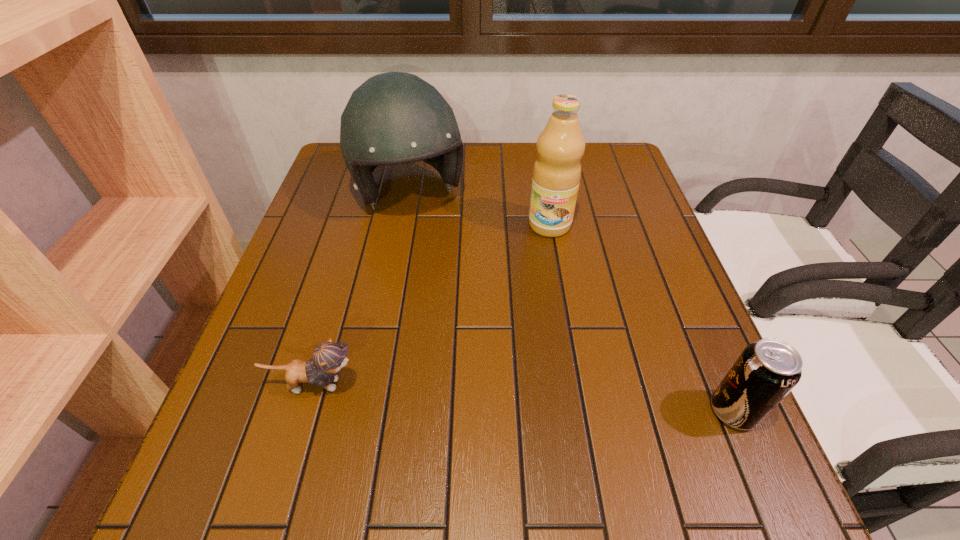
Locate an element on the screen. object present at the near left corner is located at coordinates (328, 358).

Where is `object at the near right corner`? This screenshot has height=540, width=960. object at the near right corner is located at coordinates (766, 371).

You are a GUI agent. You are given a task and a screenshot of the screen. Output one action in this format:
    pyautogui.click(x=<x>, y=<y>)
    Task: Click on the vacant space at the far edge
    This screenshot has width=960, height=540.
    Given the screenshot: What is the action you would take?
    pyautogui.click(x=503, y=152)

Identify the location of vacant space at the near edge. (646, 437).

Locate an element on the screen. free space at the left edge of the desktop is located at coordinates (361, 211).

In the image, there is a desktop. What are the coordinates of `vacant space at the right edge` in the screenshot? It's located at (645, 299).

You are a GUI agent. You are given a task and a screenshot of the screen. Output one action in this format:
    pyautogui.click(x=<x>, y=<y>)
    Task: Click on the free space between the soda can and the football helmet
    The width and height of the screenshot is (960, 540).
    Given the screenshot: What is the action you would take?
    pyautogui.click(x=571, y=302)

Locate an element on the screen. This screenshot has height=540, width=960. free space between the olive oil and the football helmet is located at coordinates (480, 210).

Where is `free spot between the second object from right to left and the kitten`? The image size is (960, 540). free spot between the second object from right to left and the kitten is located at coordinates (431, 305).

Where is `free area in between the rightmost object and the olive oil`? free area in between the rightmost object and the olive oil is located at coordinates (641, 318).